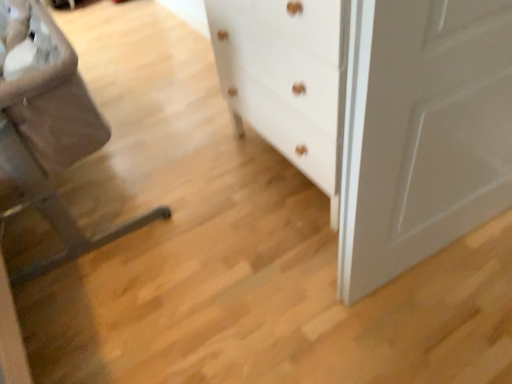
Question: Does white matte chest of drawers at center come in front of brown fabric rocking chair at left?

Choices:
 (A) yes
 (B) no

Answer: (B)

Question: Is the position of white matte chest of drawers at center more distant than that of brown fabric rocking chair at left?

Choices:
 (A) yes
 (B) no

Answer: (A)

Question: Can you confirm if white matte chest of drawers at center is positioned to the left of brown fabric rocking chair at left?

Choices:
 (A) yes
 (B) no

Answer: (B)

Question: Considering the relative sizes of white matte chest of drawers at center and brown fabric rocking chair at left in the image provided, is white matte chest of drawers at center shorter than brown fabric rocking chair at left?

Choices:
 (A) no
 (B) yes

Answer: (A)

Question: From the image's perspective, is white matte chest of drawers at center located beneath brown fabric rocking chair at left?

Choices:
 (A) no
 (B) yes

Answer: (A)

Question: Is white matte chest of drawers at center smaller than brown fabric rocking chair at left?

Choices:
 (A) yes
 (B) no

Answer: (A)

Question: Can you confirm if brown fabric rocking chair at left is bigger than white matte chest of drawers at center?

Choices:
 (A) no
 (B) yes

Answer: (B)

Question: Is brown fabric rocking chair at left in front of white matte chest of drawers at center?

Choices:
 (A) no
 (B) yes

Answer: (B)

Question: Is brown fabric rocking chair at left beside white matte chest of drawers at center?

Choices:
 (A) yes
 (B) no

Answer: (B)

Question: Does brown fabric rocking chair at left come behind white matte chest of drawers at center?

Choices:
 (A) yes
 (B) no

Answer: (B)

Question: Is brown fabric rocking chair at left not within white matte chest of drawers at center?

Choices:
 (A) yes
 (B) no

Answer: (A)

Question: Considering the relative sizes of brown fabric rocking chair at left and white matte chest of drawers at center in the image provided, is brown fabric rocking chair at left shorter than white matte chest of drawers at center?

Choices:
 (A) no
 (B) yes

Answer: (B)

Question: Visually, is white matte chest of drawers at center positioned to the left or to the right of brown fabric rocking chair at left?

Choices:
 (A) left
 (B) right

Answer: (B)